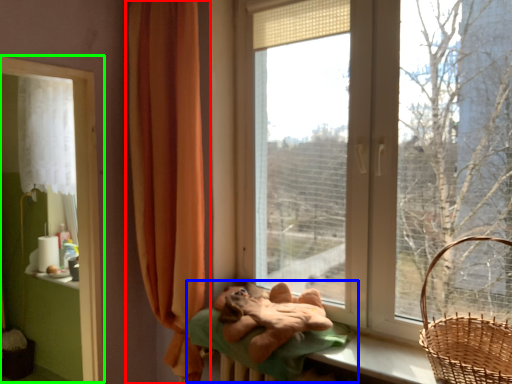
Question: Which object is positioned farthest from curtain (highlighted by a red box)? Select from bed (highlighted by a blue box) and window frame (highlighted by a green box).

Choices:
 (A) bed
 (B) window frame

Answer: (A)